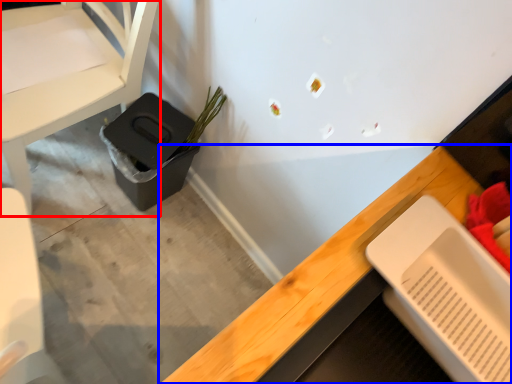
Question: Which object is closer to the camera taking this photo, chair (highlighted by a red box) or desk (highlighted by a blue box)?

Choices:
 (A) chair
 (B) desk

Answer: (B)